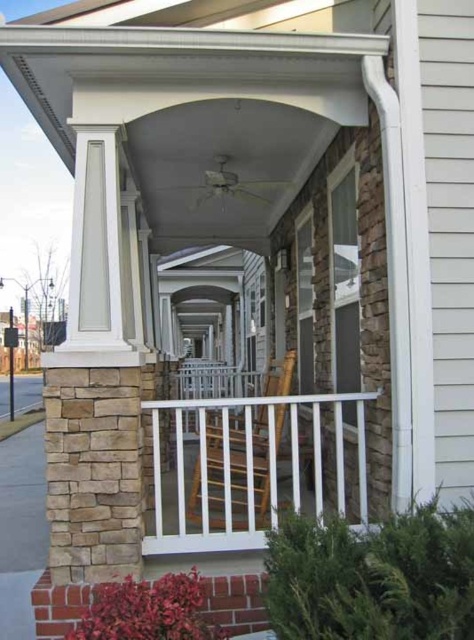
Does white plastic balustrade at center appear under wooden rocking chair at center?

Correct, white plastic balustrade at center is located below wooden rocking chair at center.

Is point (335, 404) farther from viewer compared to point (233, 493)?

No, it is not.

Which is in front, point (228, 413) or point (193, 490)?

Point (193, 490) is in front.

This screenshot has width=474, height=640. What are the coordinates of `white plastic balustrade at center` in the screenshot? It's located at (255, 468).